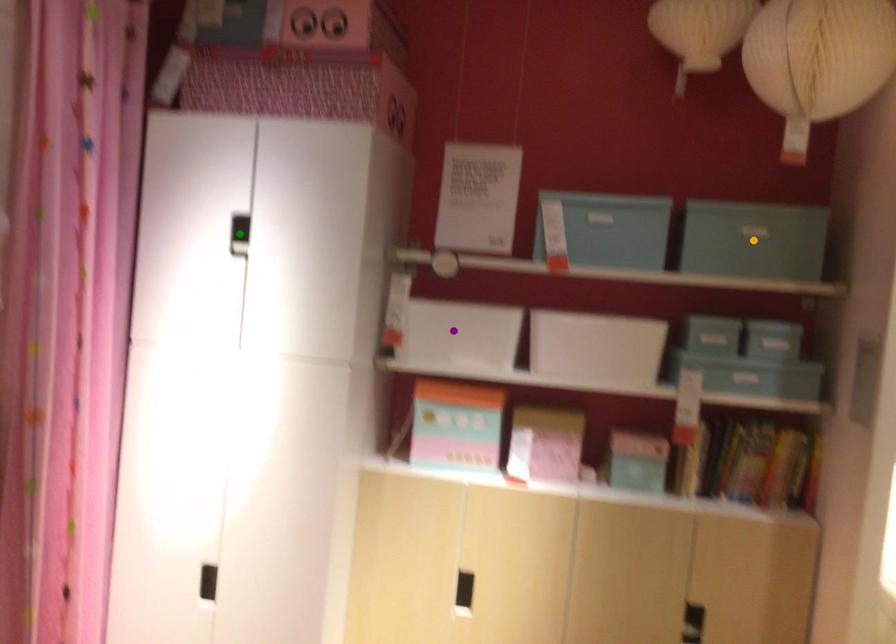
Order these from nearest to farthest:
1. purple point
2. orange point
3. green point

orange point → purple point → green point